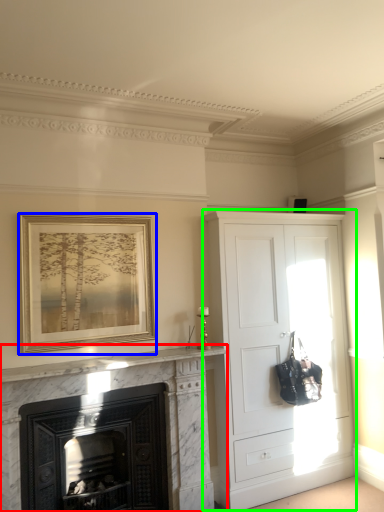
Question: Which object is the closest to the fireplace (highlighted by a red box)? Choose among these: picture frame (highlighted by a blue box) or cupboard (highlighted by a green box).

Choices:
 (A) picture frame
 (B) cupboard

Answer: (A)